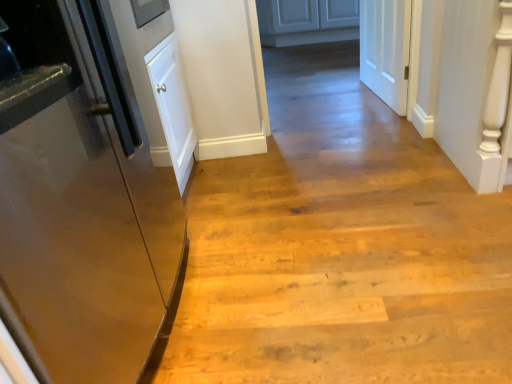
Question: Does glossy metallic refrigerator at left, marked as the second door in a top-to-bottom arrangement, contain matte white cabinets at center?

Choices:
 (A) no
 (B) yes

Answer: (A)

Question: Is glossy metallic refrigerator at left, which ranks as the 1th door in left-to-right order, shorter than matte white cabinets at center?

Choices:
 (A) no
 (B) yes

Answer: (A)

Question: Considering the relative sizes of glossy metallic refrigerator at left, which is the 2th door from back to front, and matte white cabinets at center in the image provided, is glossy metallic refrigerator at left, which is the 2th door from back to front, smaller than matte white cabinets at center?

Choices:
 (A) yes
 (B) no

Answer: (B)

Question: From the image's perspective, is glossy metallic refrigerator at left, which ranks as the 1th door in left-to-right order, on matte white cabinets at center?

Choices:
 (A) no
 (B) yes

Answer: (A)

Question: Does glossy metallic refrigerator at left, which is the 2th door from back to front, appear on the right side of matte white cabinets at center?

Choices:
 (A) yes
 (B) no

Answer: (B)

Question: Is glossy metallic refrigerator at left, marked as the first door in a front-to-back arrangement, wider or thinner than matte white cabinets at center?

Choices:
 (A) thin
 (B) wide

Answer: (A)

Question: From the image's perspective, is glossy metallic refrigerator at left, marked as the second door in a top-to-bottom arrangement, above or below matte white cabinets at center?

Choices:
 (A) below
 (B) above

Answer: (A)

Question: In the image, is glossy metallic refrigerator at left, marked as the second door in a top-to-bottom arrangement, positioned in front of or behind matte white cabinets at center?

Choices:
 (A) behind
 (B) front

Answer: (B)

Question: From a real-world perspective, relative to matte white cabinets at center, is glossy metallic refrigerator at left, marked as the first door in a front-to-back arrangement, vertically above or below?

Choices:
 (A) below
 (B) above

Answer: (B)

Question: From the image's perspective, is glossy metallic refrigerator at left, marked as the first door in a front-to-back arrangement, located above or below white matte door at upper right, arranged as the second door when viewed from the front?

Choices:
 (A) below
 (B) above

Answer: (A)

Question: Is glossy metallic refrigerator at left, which ranks as the 1th door in left-to-right order, spatially inside white matte door at upper right, the first door from the top, or outside of it?

Choices:
 (A) outside
 (B) inside

Answer: (A)

Question: Considering the positions of point tap(106, 314) and point tap(406, 72), is point tap(106, 314) closer or farther from the camera than point tap(406, 72)?

Choices:
 (A) farther
 (B) closer

Answer: (B)

Question: Looking at their shapes, would you say glossy metallic refrigerator at left, which is the 2th door from back to front, is wider or thinner than white matte door at upper right, arranged as the second door when viewed from the front?

Choices:
 (A) wide
 (B) thin

Answer: (A)

Question: From a real-world perspective, is white matte door at upper right, which is the 2th door from left to right, positioned above or below matte white cabinets at center?

Choices:
 (A) below
 (B) above

Answer: (B)

Question: From the image's perspective, is white matte door at upper right, which is the second door from bottom to top, above or below matte white cabinets at center?

Choices:
 (A) above
 (B) below

Answer: (B)